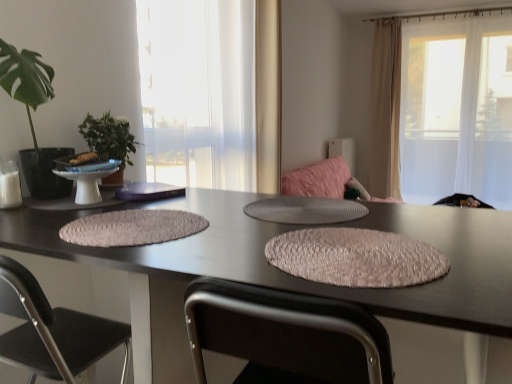
Question: In the image, is matte black table at center on the left side or the right side of green leafy plant at left, positioned as the first houseplant in front-to-back order?

Choices:
 (A) left
 (B) right

Answer: (B)

Question: In terms of height, does matte black table at center look taller or shorter compared to green leafy plant at left, positioned as the first houseplant in front-to-back order?

Choices:
 (A) short
 (B) tall

Answer: (B)

Question: Estimate the real-world distances between objects in this image. Which object is closer to the matte gray placemat at center?

Choices:
 (A) green leafy plant at left, which appears as the 1th houseplant when viewed from the back
 (B) green leafy plant at left, positioned as the first houseplant in front-to-back order
 (C) translucent fabric window at upper right, which is the second window in left-to-right order
 (D) textured beige placemat at center, arranged as the 1th yoga mat when viewed from the right
 (E) beige fabric curtain at upper right

Answer: (D)

Question: Which object is positioned closest to the matte gray placemat at center?

Choices:
 (A) matte black table at center
 (B) translucent glass window at center, which appears as the 2th window when viewed from the right
 (C) green leafy plant at left, positioned as the first houseplant in front-to-back order
 (D) translucent fabric window at upper right, which is the second window in left-to-right order
 (E) green leafy plant at left, positioned as the second houseplant in front-to-back order

Answer: (A)